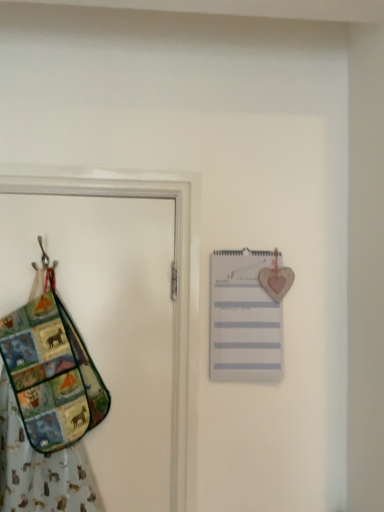
Question: From a real-world perspective, is multicolored fabric handbag at left over multicolored fabric door at left?

Choices:
 (A) no
 (B) yes

Answer: (A)

Question: From the image's perspective, would you say multicolored fabric handbag at left is shown under multicolored fabric door at left?

Choices:
 (A) no
 (B) yes

Answer: (B)

Question: Is multicolored fabric handbag at left shorter than multicolored fabric door at left?

Choices:
 (A) yes
 (B) no

Answer: (A)

Question: Is multicolored fabric handbag at left to the right of multicolored fabric door at left from the viewer's perspective?

Choices:
 (A) yes
 (B) no

Answer: (B)

Question: Is multicolored fabric handbag at left not inside multicolored fabric door at left?

Choices:
 (A) yes
 (B) no

Answer: (A)

Question: Is multicolored fabric handbag at left looking in the opposite direction of multicolored fabric door at left?

Choices:
 (A) no
 (B) yes

Answer: (B)

Question: From a real-world perspective, is multicolored fabric handbag at left beneath white paper list at upper right?

Choices:
 (A) no
 (B) yes

Answer: (B)

Question: Is multicolored fabric handbag at left outside of white paper list at upper right?

Choices:
 (A) yes
 (B) no

Answer: (A)

Question: Is multicolored fabric handbag at left far from white paper list at upper right?

Choices:
 (A) yes
 (B) no

Answer: (B)

Question: Considering the relative sizes of multicolored fabric handbag at left and white paper list at upper right in the image provided, is multicolored fabric handbag at left bigger than white paper list at upper right?

Choices:
 (A) yes
 (B) no

Answer: (A)

Question: Is multicolored fabric handbag at left smaller than white paper list at upper right?

Choices:
 (A) no
 (B) yes

Answer: (A)

Question: Is multicolored fabric handbag at left positioned before white paper list at upper right?

Choices:
 (A) no
 (B) yes

Answer: (B)

Question: From a real-world perspective, is multicolored fabric door at left located beneath multicolored fabric handbag at left?

Choices:
 (A) no
 (B) yes

Answer: (A)